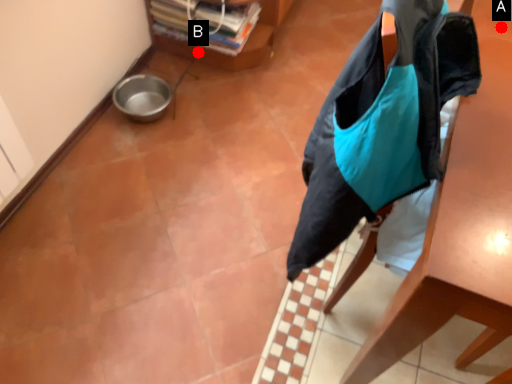
Question: Two points are circled on the image, labeled by A and B beside each circle. Which point is farther to the camera?

Choices:
 (A) A is further
 (B) B is further

Answer: (B)